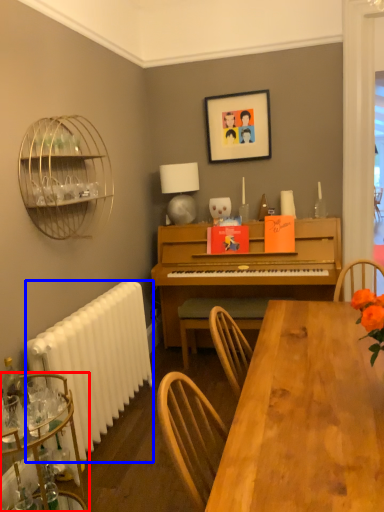
Question: Which point is further to the camera, desk (highlighted by a red box) or radiator (highlighted by a blue box)?

Choices:
 (A) desk
 (B) radiator

Answer: (B)